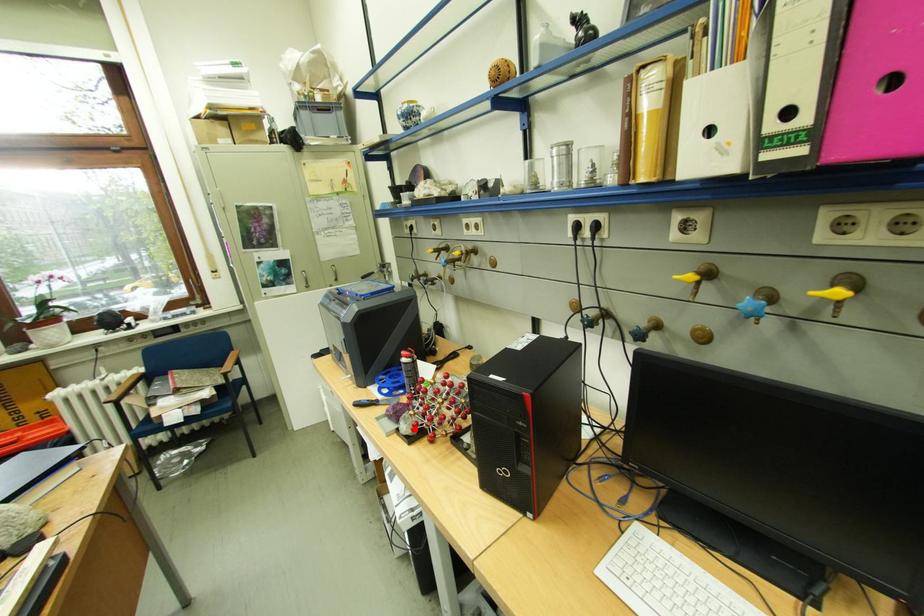
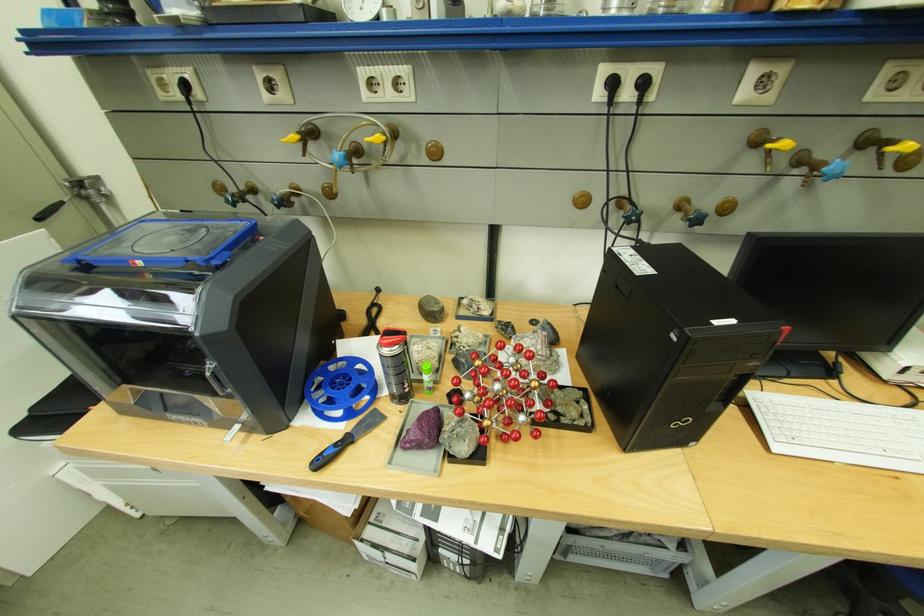
Locate, in the second image, the point that corresponds to the highlighted location in the first image.

(475, 448)